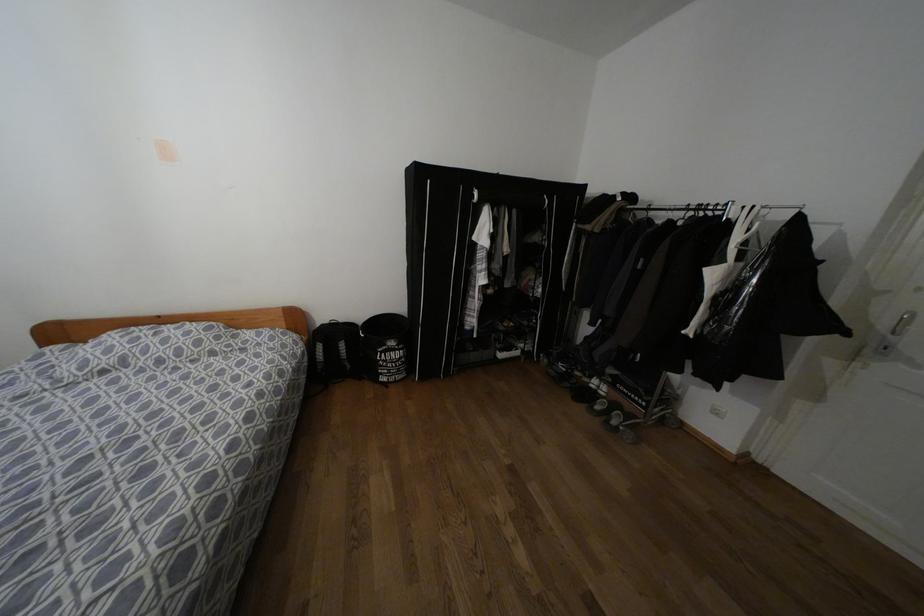
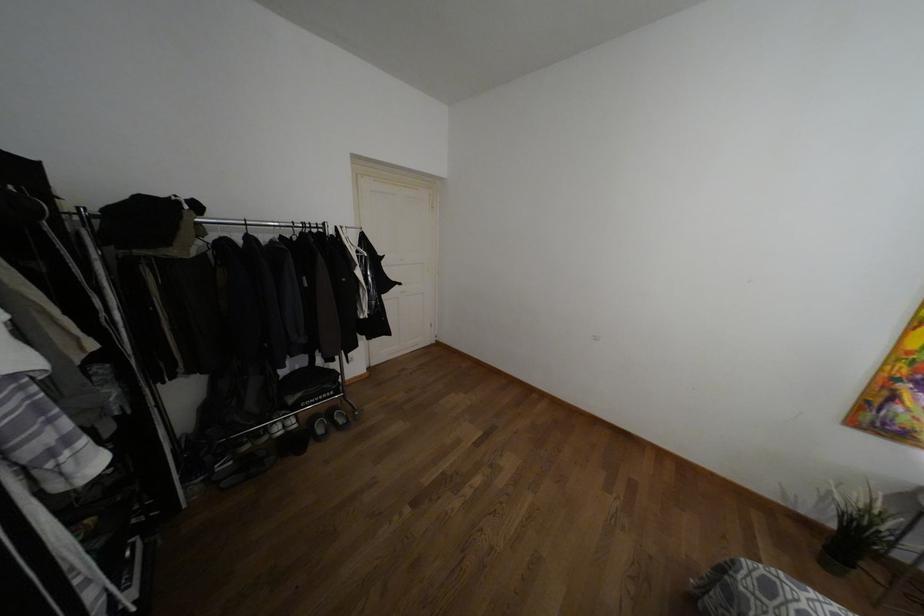
Find the pixel in the second image that matches (x=597, y=407) in the first image.

(320, 430)